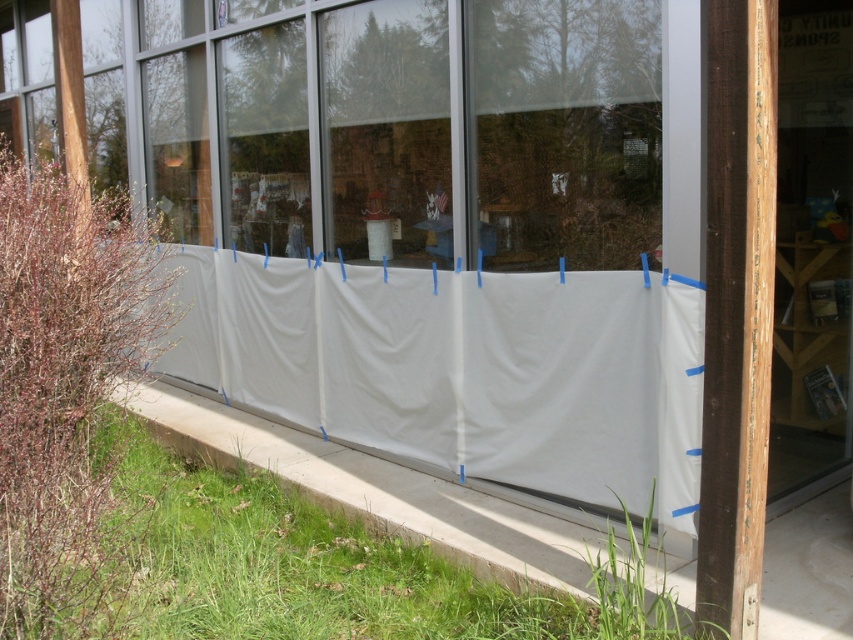
Question: Is transparent plastic sheet at center below white fabric curtain at lower center?

Choices:
 (A) no
 (B) yes

Answer: (A)

Question: Which point is closer to the camera taking this photo?

Choices:
 (A) click(817, 108)
 (B) click(524, 150)

Answer: (A)

Question: Which point is farther from the camera taking this photo?

Choices:
 (A) (345, 90)
 (B) (207, 388)

Answer: (B)

Question: Which of the following is the farthest from the observer?

Choices:
 (A) (570, 433)
 (B) (210, 236)

Answer: (B)

Question: Can you confirm if white fabric curtain at lower center is bigger than white fabric screen door at right?

Choices:
 (A) no
 (B) yes

Answer: (B)

Question: From the image, what is the correct spatial relationship of transparent plastic sheet at center in relation to white fabric curtain at lower center?

Choices:
 (A) right
 (B) left

Answer: (A)